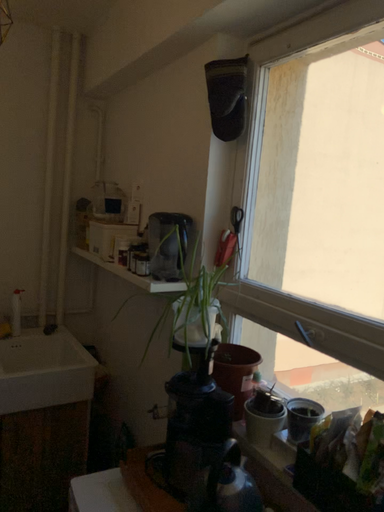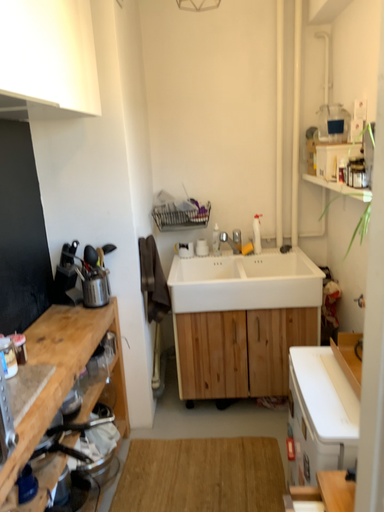
Question: How did the camera likely rotate when shooting the video?

Choices:
 (A) rotated downward
 (B) rotated upward

Answer: (A)